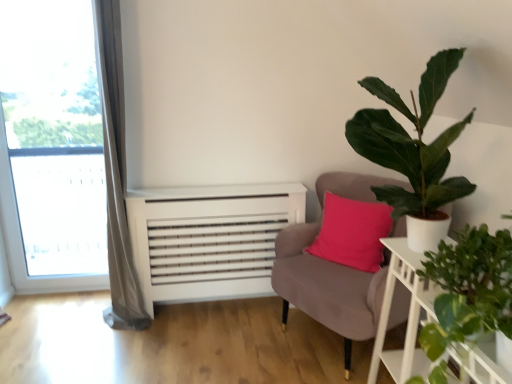
Question: Is velvet pink chair at center outside of green leafy plant at right, positioned as the 2th houseplant in top-to-bottom order?

Choices:
 (A) no
 (B) yes

Answer: (B)

Question: Is velvet pink chair at center next to green leafy plant at right, positioned as the 2th houseplant in top-to-bottom order, and touching it?

Choices:
 (A) no
 (B) yes

Answer: (A)

Question: Can you confirm if velvet pink chair at center is thinner than green leafy plant at right, arranged as the 1th houseplant when ordered from the bottom?

Choices:
 (A) no
 (B) yes

Answer: (A)

Question: Can you confirm if velvet pink chair at center is positioned to the right of green leafy plant at right, positioned as the 2th houseplant in top-to-bottom order?

Choices:
 (A) yes
 (B) no

Answer: (B)

Question: From the image's perspective, is velvet pink chair at center on green leafy plant at right, arranged as the 1th houseplant when ordered from the bottom?

Choices:
 (A) no
 (B) yes

Answer: (A)

Question: Are velvet pink chair at center and green leafy plant at right, arranged as the 1th houseplant when ordered from the bottom, far apart?

Choices:
 (A) no
 (B) yes

Answer: (A)

Question: Does green leafy plant at right, arranged as the 1th houseplant when ordered from the bottom, have a greater width compared to green matte plant at upper right, which appears as the 1th houseplant when viewed from the top?

Choices:
 (A) no
 (B) yes

Answer: (A)

Question: Does green leafy plant at right, arranged as the 1th houseplant when ordered from the bottom, have a greater height compared to green matte plant at upper right, which appears as the 1th houseplant when viewed from the top?

Choices:
 (A) yes
 (B) no

Answer: (B)

Question: Can you confirm if green leafy plant at right, arranged as the 1th houseplant when ordered from the bottom, is bigger than green matte plant at upper right, which appears as the 1th houseplant when viewed from the top?

Choices:
 (A) no
 (B) yes

Answer: (A)

Question: Is green leafy plant at right, positioned as the 2th houseplant in top-to-bottom order, far from green matte plant at upper right, which appears as the 1th houseplant when viewed from the top?

Choices:
 (A) yes
 (B) no

Answer: (B)

Question: From the image's perspective, is green leafy plant at right, arranged as the 1th houseplant when ordered from the bottom, located above green matte plant at upper right, which appears as the 2th houseplant when ordered from the bottom?

Choices:
 (A) yes
 (B) no

Answer: (B)

Question: Is green leafy plant at right, positioned as the 2th houseplant in top-to-bottom order, positioned behind green matte plant at upper right, which appears as the 2th houseplant when ordered from the bottom?

Choices:
 (A) no
 (B) yes

Answer: (B)

Question: Is the surface of transparent glass window at left in direct contact with green leafy plant at right, arranged as the 1th houseplant when ordered from the bottom?

Choices:
 (A) no
 (B) yes

Answer: (A)